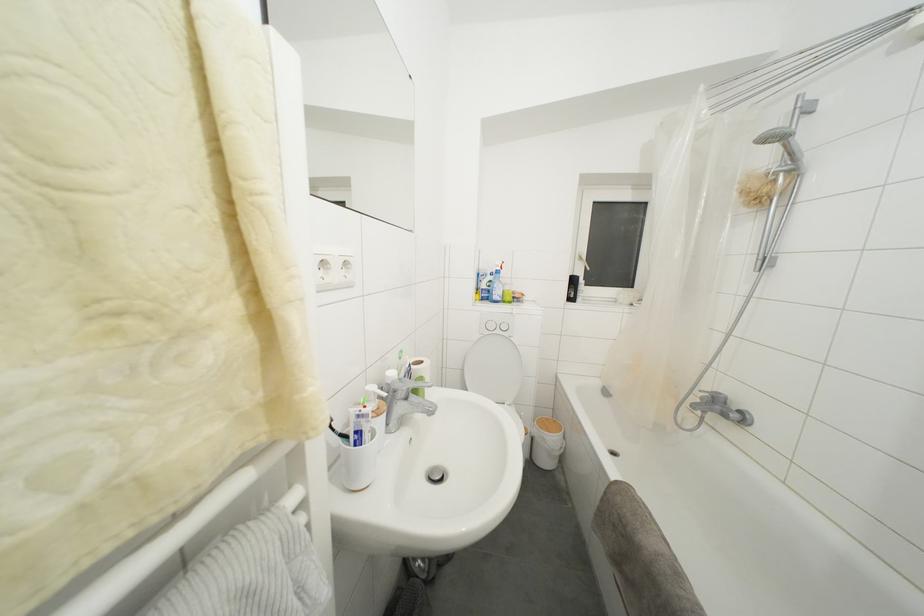
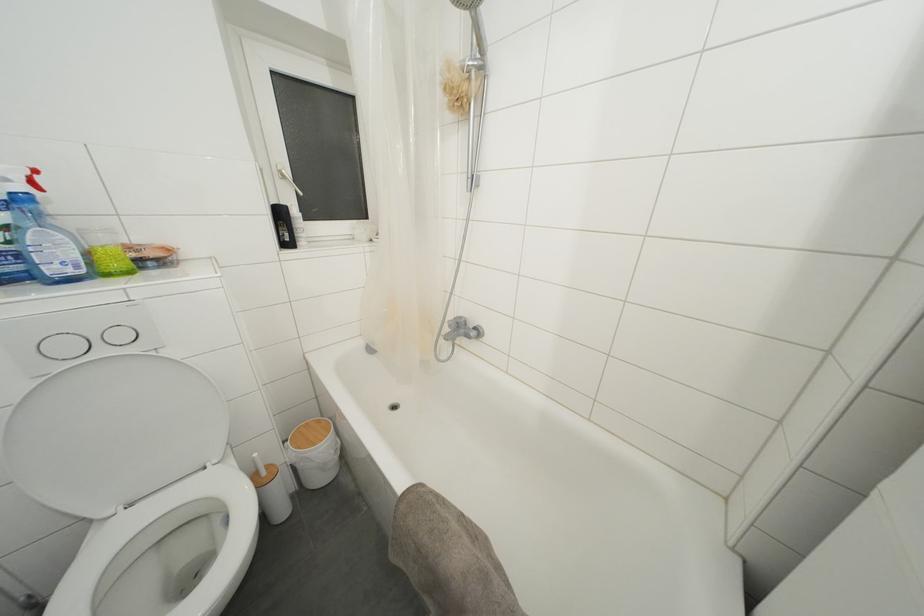
The point at (512, 293) is marked in the first image. Where is the corresponding point in the second image?

(108, 245)